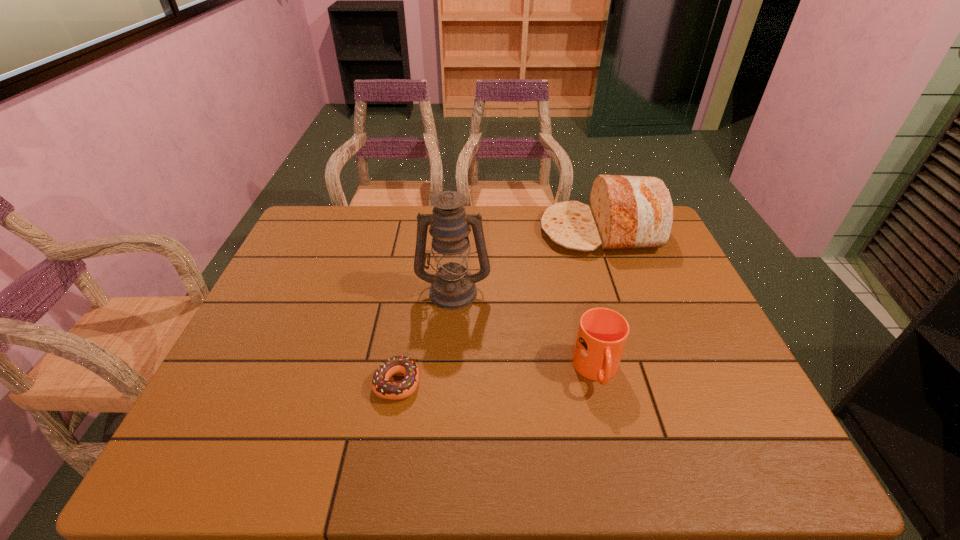
You are a GUI agent. You are given a task and a screenshot of the screen. Output one action in this format:
    pyautogui.click(x=<x>, y=<y>)
    Task: Click on the vacant space located 0.050m on the handle side of the second shortest object
    This screenshot has height=540, width=960.
    Given the screenshot: What is the action you would take?
    pyautogui.click(x=609, y=420)

At what (x,y) coordinates should I click in order to perform the action: click on vacant space located on the front of the doughnut. Please return your answer as a coordinate pair (x, y). Looking at the image, I should click on (384, 461).

You are a GUI agent. You are given a task and a screenshot of the screen. Output one action in this format:
    pyautogui.click(x=<x>, y=<y>)
    Task: Click on the object that is positioned at the far edge
    
    Given the screenshot: What is the action you would take?
    pyautogui.click(x=626, y=212)

The height and width of the screenshot is (540, 960). In order to click on object situated at the right edge in this screenshot , I will do point(626,212).

Identify the location of object located at the far right corner. The image size is (960, 540). (626, 212).

This screenshot has width=960, height=540. Find the location of `vacant space at the far edge`. vacant space at the far edge is located at coordinates 486,208.

The image size is (960, 540). I want to click on vacant space at the near edge of the desktop, so click(476, 455).

Locate an element on the screen. This screenshot has height=540, width=960. vacant region at the left edge is located at coordinates (304, 268).

The height and width of the screenshot is (540, 960). Find the location of `vacant space at the right edge of the desktop`. vacant space at the right edge of the desktop is located at coordinates (687, 305).

Where is `free region at the far left corner of the desktop`? The width and height of the screenshot is (960, 540). free region at the far left corner of the desktop is located at coordinates (333, 233).